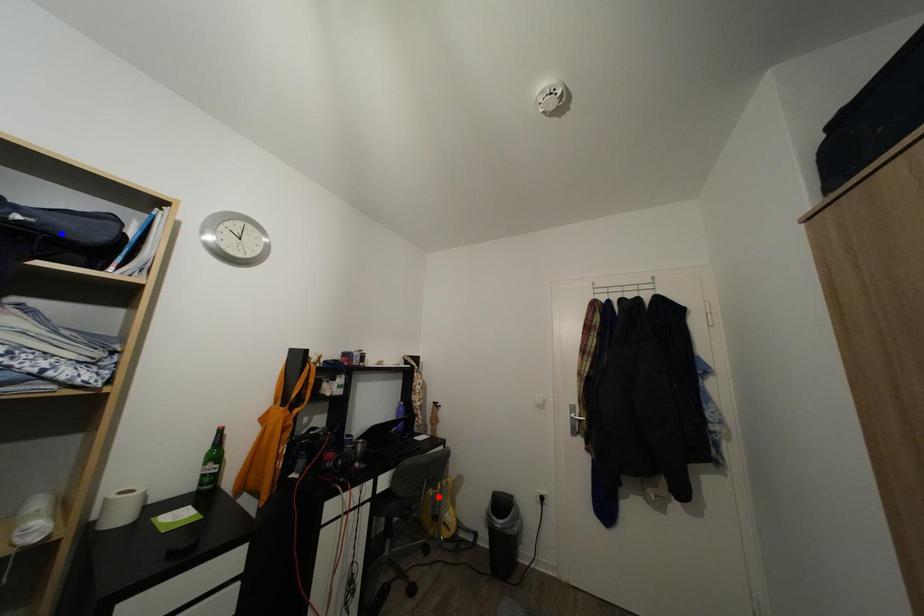
Question: In the image, two points are highlighted. Which point is nearer to the camera? Reply with the corresponding letter.

Choices:
 (A) blue point
 (B) red point

Answer: (A)